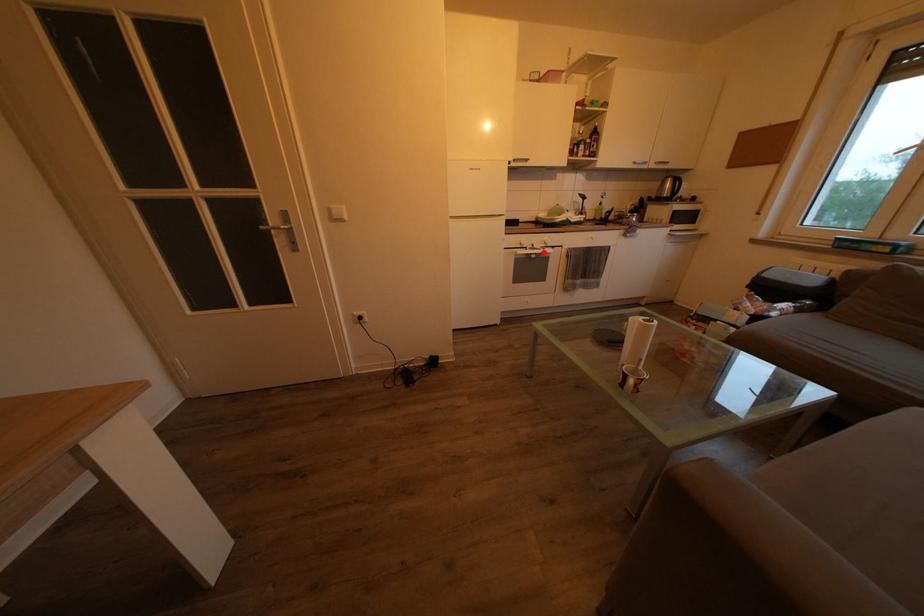
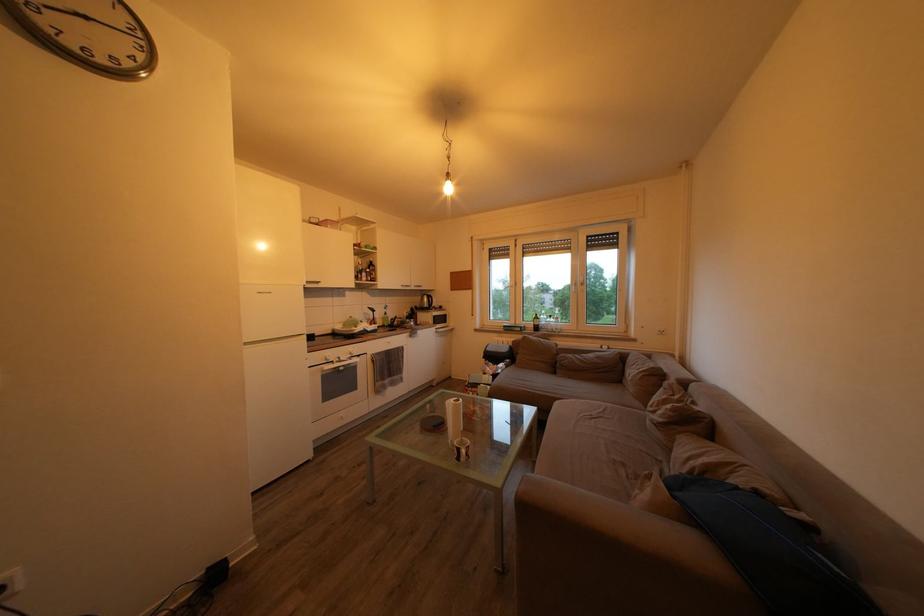
Question: A red point is marked in image1. In image2, is the corresponding 3D point closer to the camera or farther? Reply with the corresponding letter.

Choices:
 (A) The corresponding 3D point is closer.
 (B) The corresponding 3D point is farther.

Answer: (B)